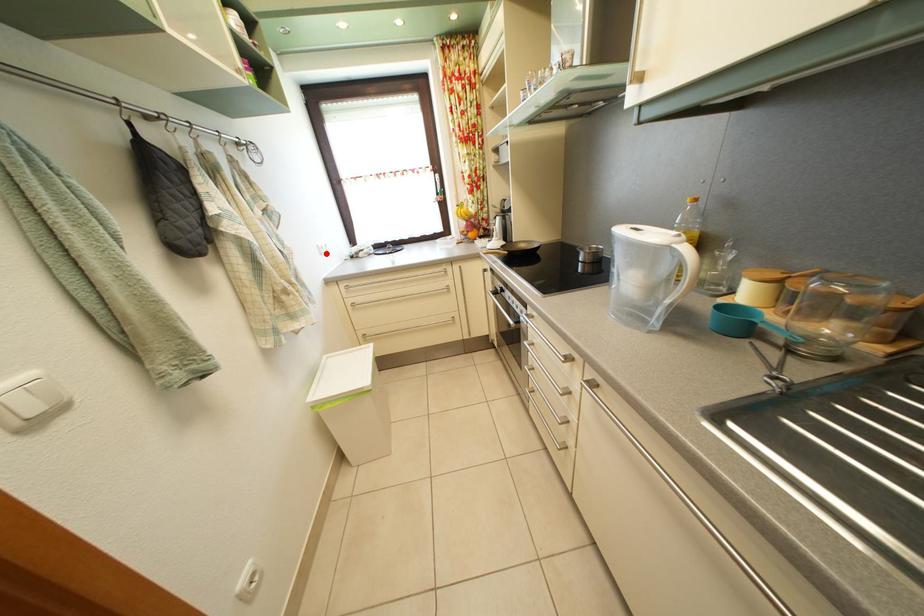
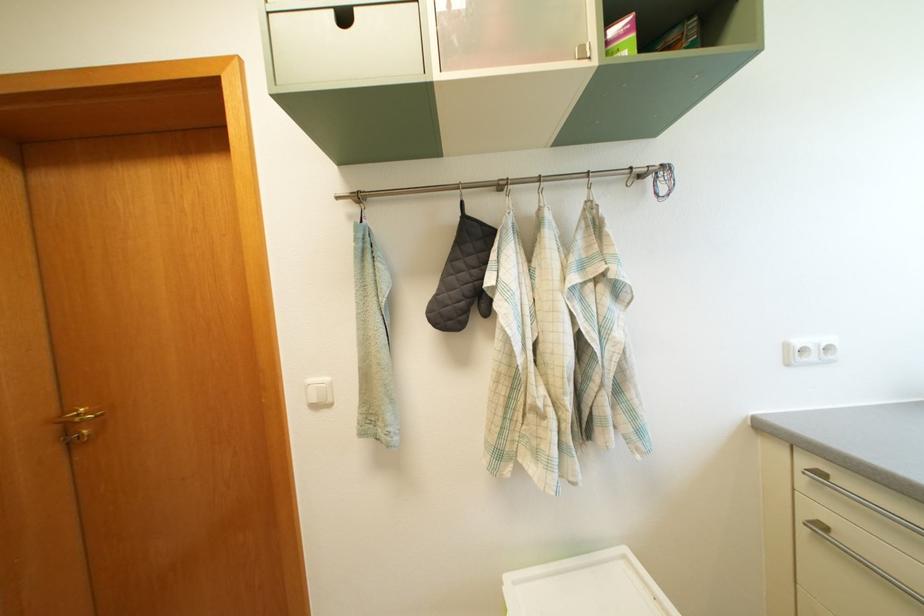
Locate, in the second image, the point that corresponds to the highlighted location in the first image.

(795, 353)